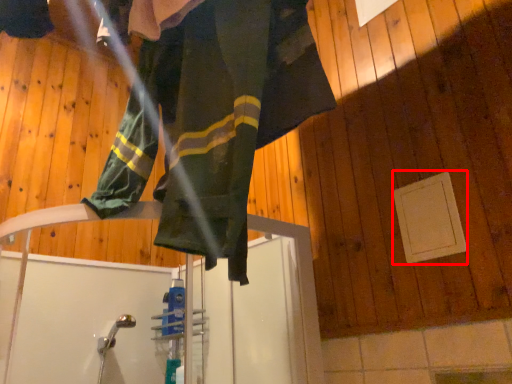
Question: From the image's perspective, what is the correct spatial positioning of panel (annotated by the red box) in reference to woman?

Choices:
 (A) below
 (B) above

Answer: (A)